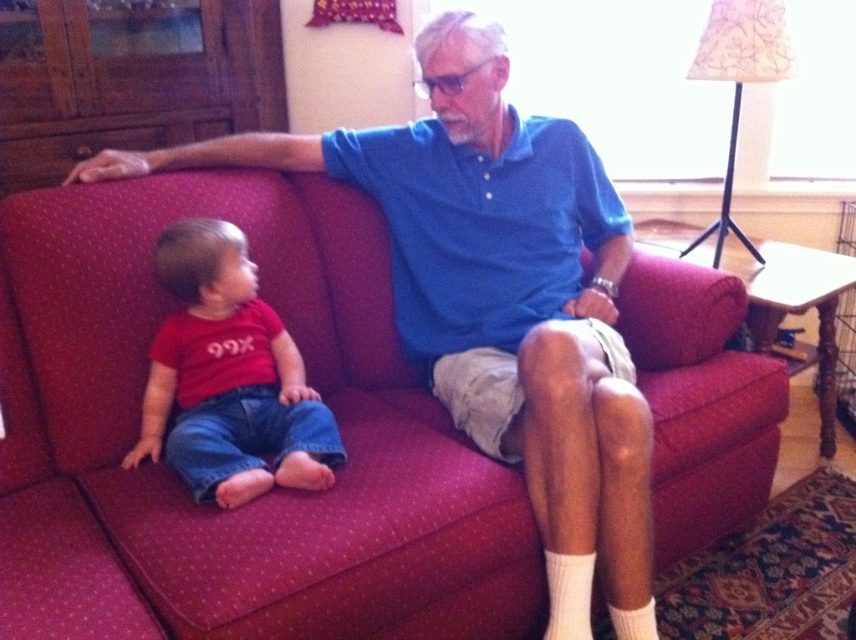
You are standing at the origin of the coordinate system in the image. You want to move to the point at the bottom right corner of the couch. Which of the two points, point (x=747, y=476) or point (x=235, y=410), is closer to your destination?

Point (x=235, y=410) is closer to the bottom right corner of the couch because it is positioned lower and further to the right compared to point (x=747, y=476).

You are a delivery robot with a package that needs to be placed between the matte red shirt at left and the white ribbed sock at lower right. The package is 25 inches long. Will it fit in the space between them?

The distance between the matte red shirt at left and the white ribbed sock at lower right is 25.44 inches, so the package will fit as it is slightly shorter than the available space.